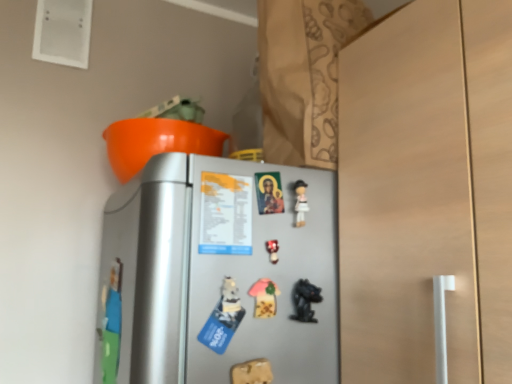
Question: Does silver metallic refrigerator at center appear on the left side of pink fabric mushroom at center, the 2th toy in the top-to-bottom sequence?

Choices:
 (A) no
 (B) yes

Answer: (A)

Question: Does silver metallic refrigerator at center appear on the right side of pink fabric mushroom at center, acting as the 3th toy starting from the bottom?

Choices:
 (A) yes
 (B) no

Answer: (A)

Question: Considering the relative positions of silver metallic refrigerator at center and pink fabric mushroom at center, acting as the 3th toy starting from the bottom, in the image provided, is silver metallic refrigerator at center behind pink fabric mushroom at center, acting as the 3th toy starting from the bottom,?

Choices:
 (A) no
 (B) yes

Answer: (A)

Question: Does silver metallic refrigerator at center have a lesser height compared to pink fabric mushroom at center, the 2th toy in the top-to-bottom sequence?

Choices:
 (A) yes
 (B) no

Answer: (B)

Question: From a real-world perspective, does silver metallic refrigerator at center stand above pink fabric mushroom at center, acting as the 3th toy starting from the bottom?

Choices:
 (A) yes
 (B) no

Answer: (A)

Question: From the image's perspective, would you say silver metallic refrigerator at center is shown under pink fabric mushroom at center, acting as the 3th toy starting from the bottom?

Choices:
 (A) no
 (B) yes

Answer: (A)

Question: Is matte plastic toy at center, which is the fourth toy from bottom to top, at the right side of black glossy figurine at lower center, positioned as the second toy in bottom-to-top order?

Choices:
 (A) no
 (B) yes

Answer: (A)

Question: Considering the relative sizes of matte plastic toy at center, which is the fourth toy from bottom to top, and black glossy figurine at lower center, the 3th toy when ordered from top to bottom, in the image provided, is matte plastic toy at center, which is the fourth toy from bottom to top, thinner than black glossy figurine at lower center, the 3th toy when ordered from top to bottom,?

Choices:
 (A) no
 (B) yes

Answer: (B)

Question: Is black glossy figurine at lower center, positioned as the second toy in bottom-to-top order, completely or partially inside matte plastic toy at center, which is the first toy in top-to-bottom order?

Choices:
 (A) no
 (B) yes

Answer: (A)

Question: From a real-world perspective, is matte plastic toy at center, which is the first toy in top-to-bottom order, below black glossy figurine at lower center, the 3th toy when ordered from top to bottom?

Choices:
 (A) yes
 (B) no

Answer: (B)

Question: Is matte plastic toy at center, which is the first toy in top-to-bottom order, oriented towards black glossy figurine at lower center, positioned as the second toy in bottom-to-top order?

Choices:
 (A) yes
 (B) no

Answer: (B)

Question: Is matte plastic toy at center, which is the fourth toy from bottom to top, far away from black glossy figurine at lower center, positioned as the second toy in bottom-to-top order?

Choices:
 (A) no
 (B) yes

Answer: (A)

Question: Is matte plastic toy at center, which is the first toy in top-to-bottom order, in front of pink fabric mushroom at center, the 2th toy in the top-to-bottom sequence?

Choices:
 (A) yes
 (B) no

Answer: (B)